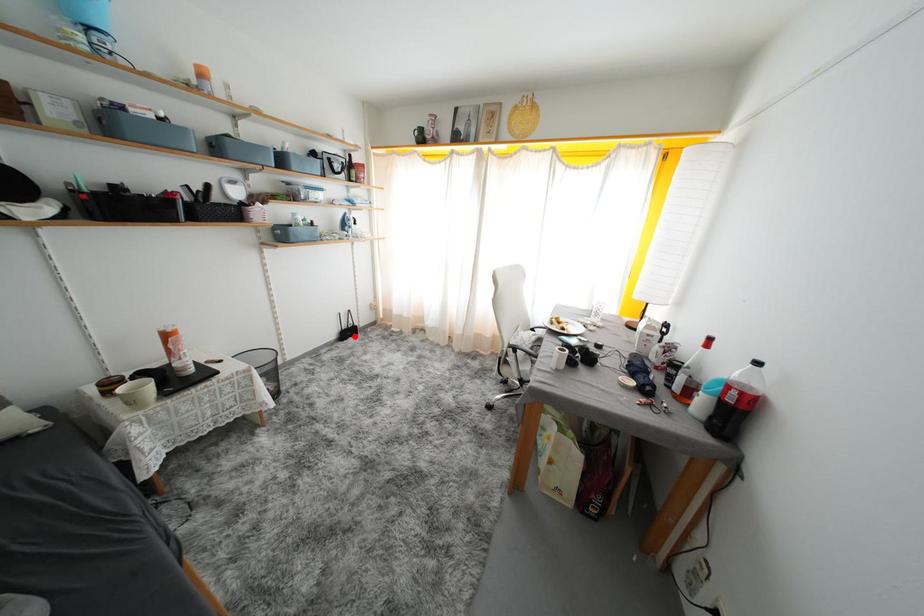
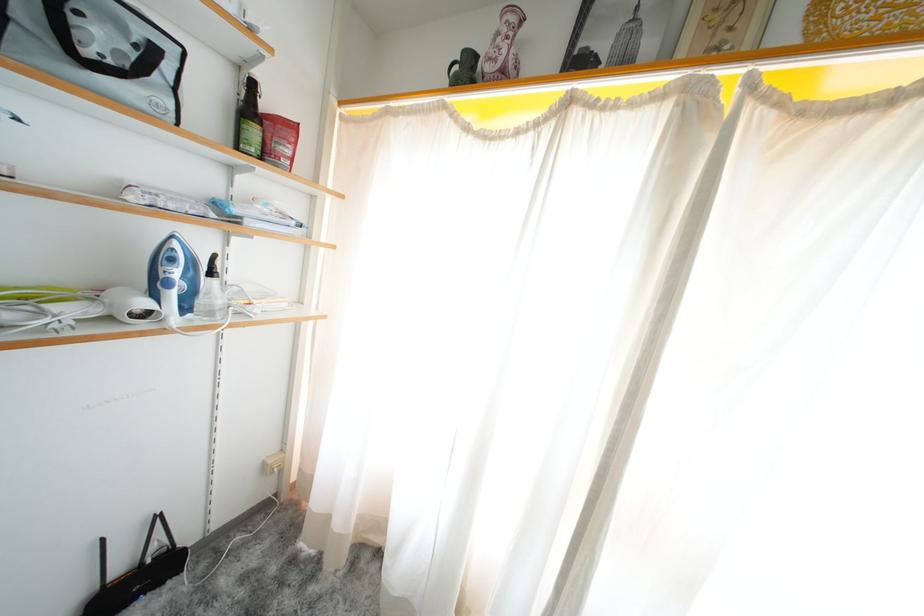
Find the pixel in the second image that matches the highlighted location in the first image.

(143, 586)